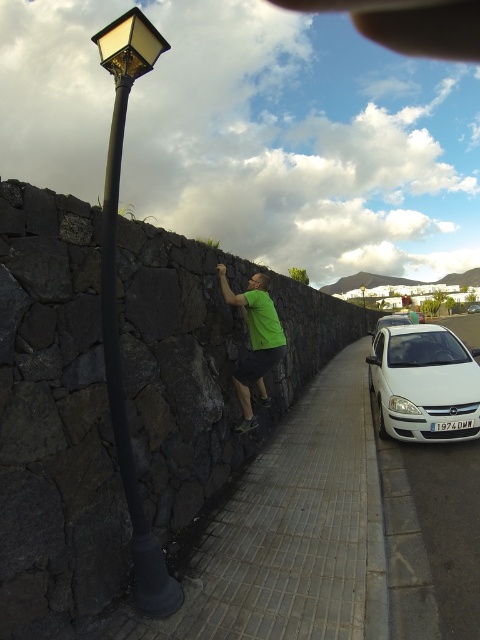
Question: Does white matte car at right appear under white glossy sedan at right?

Choices:
 (A) yes
 (B) no

Answer: (A)

Question: Is gray tile pavement at center bigger than matte black street light at left?

Choices:
 (A) yes
 (B) no

Answer: (B)

Question: Which point appears closest to the camera in this image?

Choices:
 (A) (374, 333)
 (B) (205, 636)
 (C) (422, 371)

Answer: (B)

Question: Among these objects, which one is nearest to the camera?

Choices:
 (A) white glossy car at right
 (B) matte black street light at left
 (C) white matte car at right

Answer: (B)

Question: Which object is the closest to the green matte shirt at center?

Choices:
 (A) white glossy car at right
 (B) matte black street light at left

Answer: (B)

Question: Can you confirm if white glossy car at right is smaller than matte black street light at upper center?

Choices:
 (A) yes
 (B) no

Answer: (B)